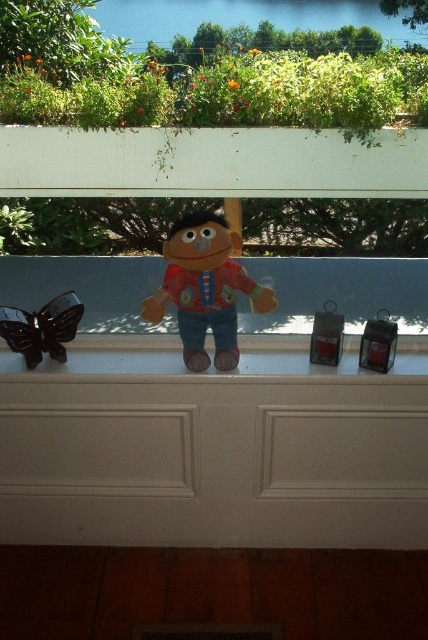
You are a delivery person who needs to place a small package on the white matte ledge at center. However, there is a matte brown plush at center already occupying space. Can you fit the package there without moving the plush?

The white matte ledge at center is larger in size than the matte brown plush at center, so there should be enough space to place the small package alongside the plush without moving it.